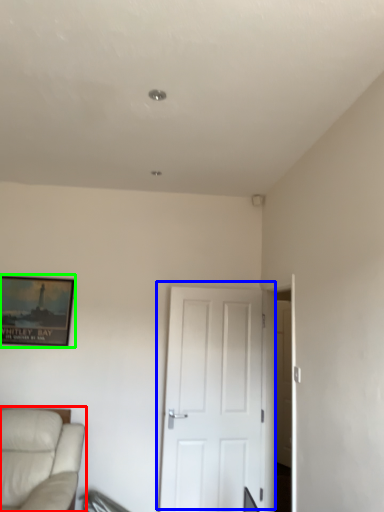
Question: Which is farther away from studio couch (highlighted by a red box)? door (highlighted by a blue box) or picture frame (highlighted by a green box)?

Choices:
 (A) door
 (B) picture frame

Answer: (A)